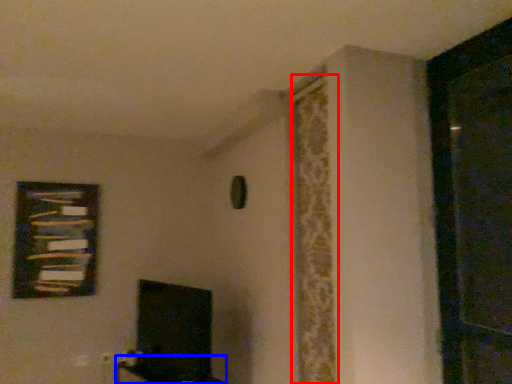
Question: Which object is further to the camera taking this photo, curtain (highlighted by a red box) or furniture (highlighted by a blue box)?

Choices:
 (A) curtain
 (B) furniture

Answer: (B)